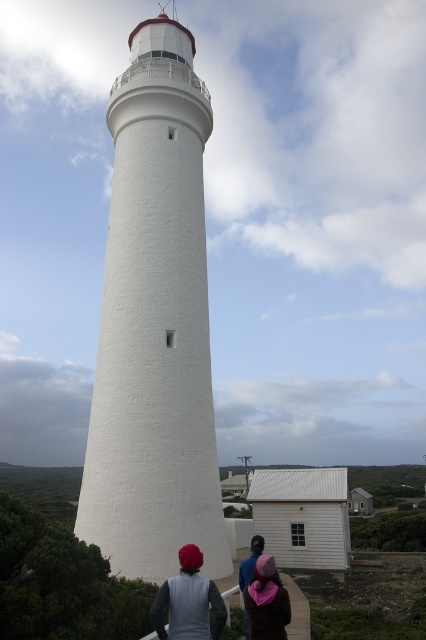
In the scene shown: You are planning to hang a banner that is 2 meters wide on the white textured lighthouse at center. Given the lighthouse is wider than the pink fabric at lower center, which is 1.5 meters wide, will the banner fit on the lighthouse?

The white textured lighthouse at center is wider than the pink fabric at lower center, which is 1.5 meters wide. Since the banner is 2 meters wide, it will fit on the lighthouse as its width is sufficient to accommodate the banner.

In the scene shown: You are standing at the base of the lighthouse and want to determine which of the two points, point (158, 67) or point (247, 573), is closer to you. Based on the scene, which point is nearer?

Point (158, 67) is closer to you because it is further to the viewer than point (247, 573).